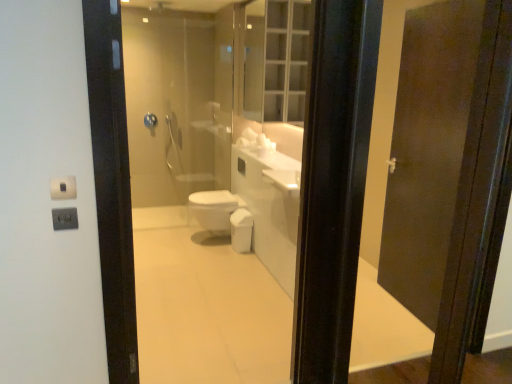
Question: Considering the positions of point (202, 218) and point (272, 59), is point (202, 218) closer or farther from the camera than point (272, 59)?

Choices:
 (A) farther
 (B) closer

Answer: (A)

Question: Considering their positions, is white glossy bidet at center located in front of or behind clear glass medicine cabinet at upper center?

Choices:
 (A) behind
 (B) front

Answer: (A)

Question: Estimate the real-world distances between objects in this image. Which object is farther from the white glossy bidet at center?

Choices:
 (A) blue plastic towel bar at upper center
 (B) clear glass medicine cabinet at upper center

Answer: (A)

Question: Based on their relative distances, which object is nearer to the blue plastic towel bar at upper center?

Choices:
 (A) clear glass medicine cabinet at upper center
 (B) white glossy bidet at center

Answer: (B)